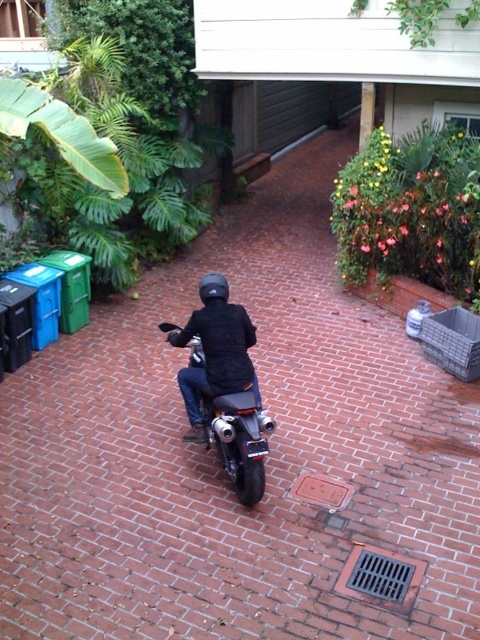
You are a delivery person who needs to place a package between the black leather jacket at center and the shiny chrome motorcycle at center. The package requires 12 inches of space. Can you fit it there?

The distance between the black leather jacket at center and the shiny chrome motorcycle at center is 10.72 inches. Since the package requires 12 inches of space, it cannot be placed there as there isn

You are standing at the point marked as point (216, 352) on the black leather jacket at center. You want to move to the motorcycle. Which direction should you go?

The point (216, 352) is on the black leather jacket at center. Since the motorcycle is positioned in front of the rider who is moving away from the camera, you should move forward to reach the motorcycle.